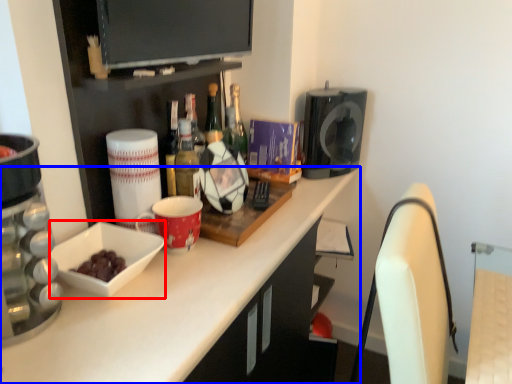
Question: Among these objects, which one is nearest to the camera, bowl (highlighted by a red box) or countertop (highlighted by a blue box)?

Choices:
 (A) bowl
 (B) countertop

Answer: (B)